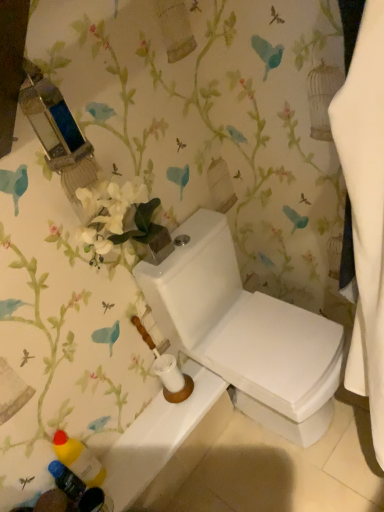
At what (x,y) coordinates should I click in order to perform the action: click on free space above white glossy toilet at lower center (from a real-world perspective). Please return your answer as a coordinate pair (x, y). The width and height of the screenshot is (384, 512). Looking at the image, I should click on (161, 431).